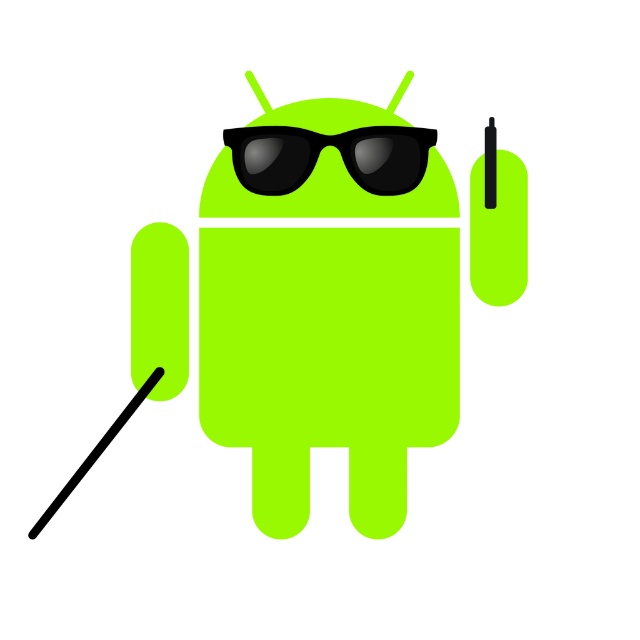
Consider the image. You are navigating through a maze and encounter the robot in the scene. The robot has two points marked on its body at coordinates point (428, 252) and point (284, 160). Which point is closer to the exit located behind the robot?

Point (428, 252) is behind point (284, 160), so the point closer to the exit behind the robot would be point (428, 252).

You are an observer looking at the lime matte android at center and the black matte sunglasses at upper center. Which object is located higher in the image?

The black matte sunglasses at upper center are located higher in the image than the lime matte android at center.